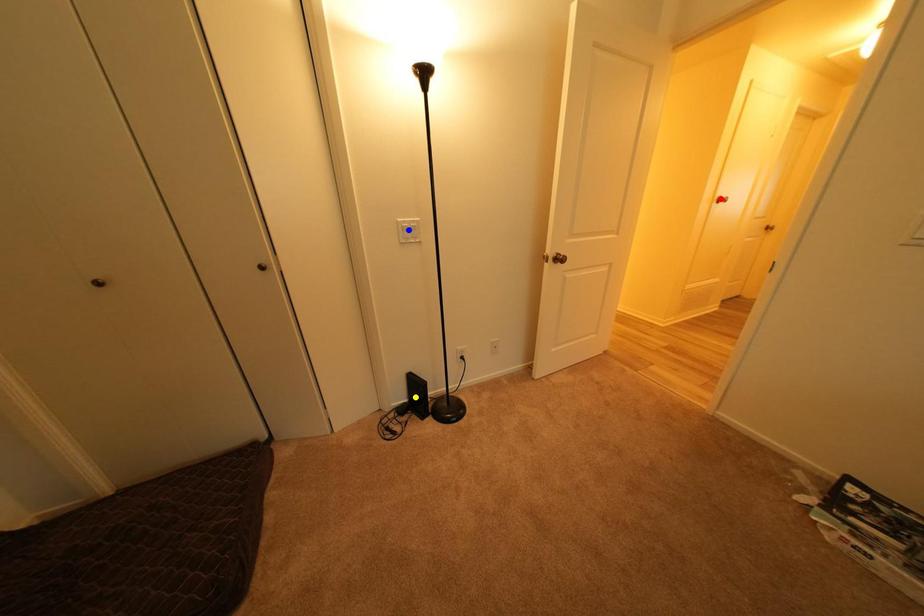
Order these from nearest to farthest:
1. yellow point
2. red point
3. blue point

1. blue point
2. yellow point
3. red point